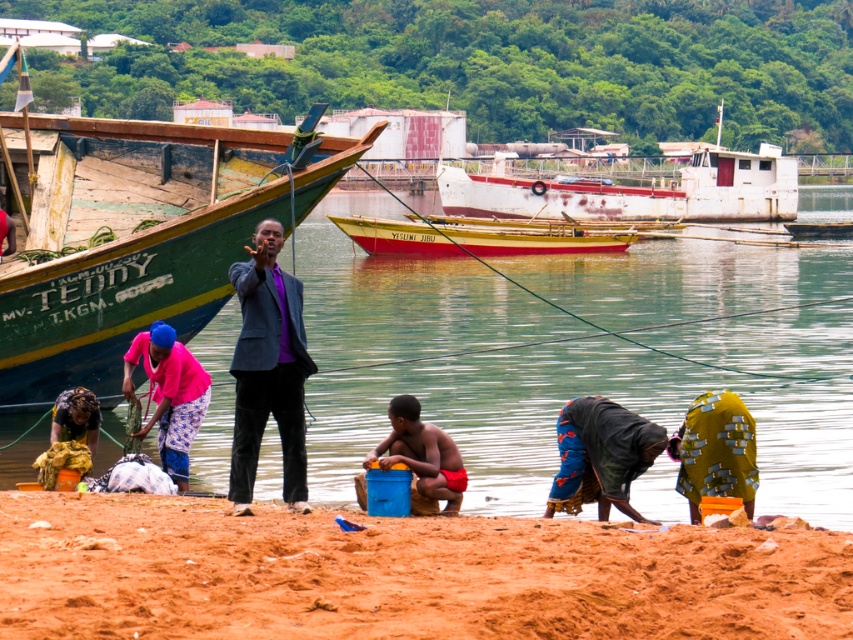
Is green wooden boat at left to the left of blue fabric bag at lower center from the viewer's perspective?

Correct, you'll find green wooden boat at left to the left of blue fabric bag at lower center.

Who is positioned more to the right, green wooden boat at left or blue fabric bag at lower center?

blue fabric bag at lower center is more to the right.

Locate an element on the screen. green wooden boat at left is located at coordinates (129, 248).

Consider the image. Which is above, green wooden boat at left or rusty metal boat at center?

rusty metal boat at center is higher up.

Who is more forward, (57, 388) or (476, 193)?

Positioned in front is point (57, 388).

Which is behind, point (80, 260) or point (636, 186)?

Point (636, 186)

Find the location of a particular element. The height and width of the screenshot is (640, 853). green wooden boat at left is located at coordinates (129, 248).

Measure the distance between matte gray blazer at center and yellow fabric at lower right.

matte gray blazer at center is 4.10 meters away from yellow fabric at lower right.

Which is in front, point (279, 390) or point (701, 454)?

Point (701, 454) is in front.

Does point (300, 396) lie behind point (686, 490)?

Yes, it is.

The height and width of the screenshot is (640, 853). What are the coordinates of `matte gray blazer at center` in the screenshot? It's located at (268, 369).